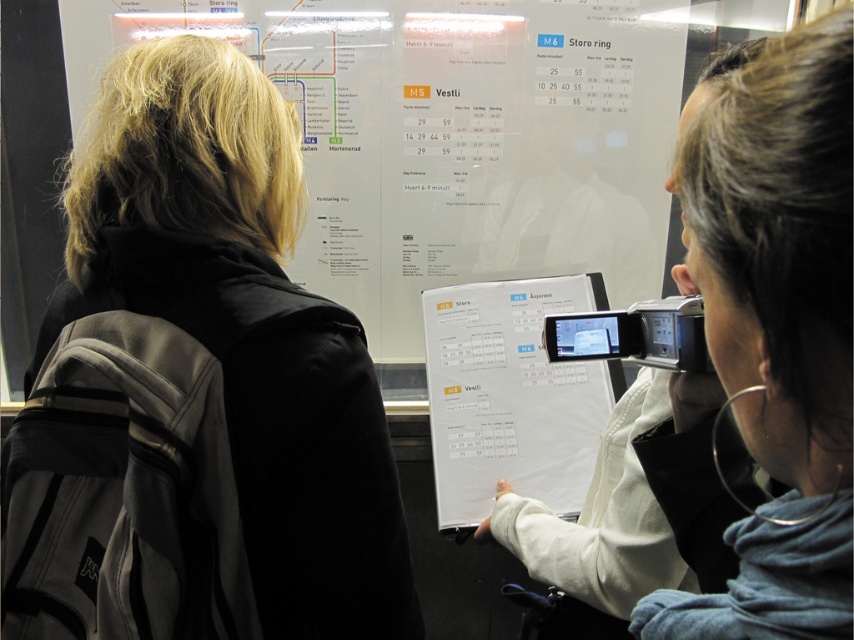
Looking at this image, you are a photographer trying to capture the white paper calendar at center without including the dark blue hoodie at upper right in the frame. Is this possible based on their positions?

The dark blue hoodie at upper right is above the white paper calendar at center, so adjusting the camera angle downward might allow capturing the calendar without the hoodie.

You are a delivery robot with a package that requires a clear path of at least 1.5 meters to move through. You need to navigate from the starting point to the destination while avoiding obstacles. There is a white paper at center and a camera. Can you safely pass between them?

The distance between the white paper at center and the camera is 1.84 meters, which is greater than the required 1.5 meters. Therefore, the delivery robot can safely pass between them.